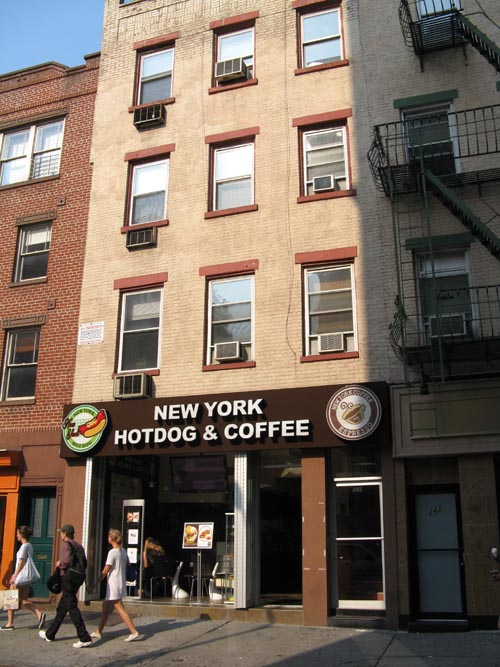
I want to click on door, so click(427, 518), click(365, 514), click(43, 527).